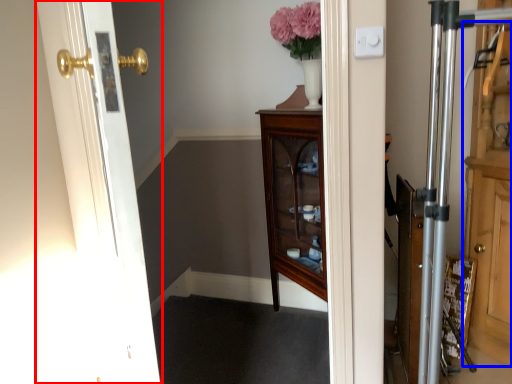
Question: Which object is further to the camera taking this photo, door (highlighted by a red box) or dresser (highlighted by a blue box)?

Choices:
 (A) door
 (B) dresser

Answer: (B)